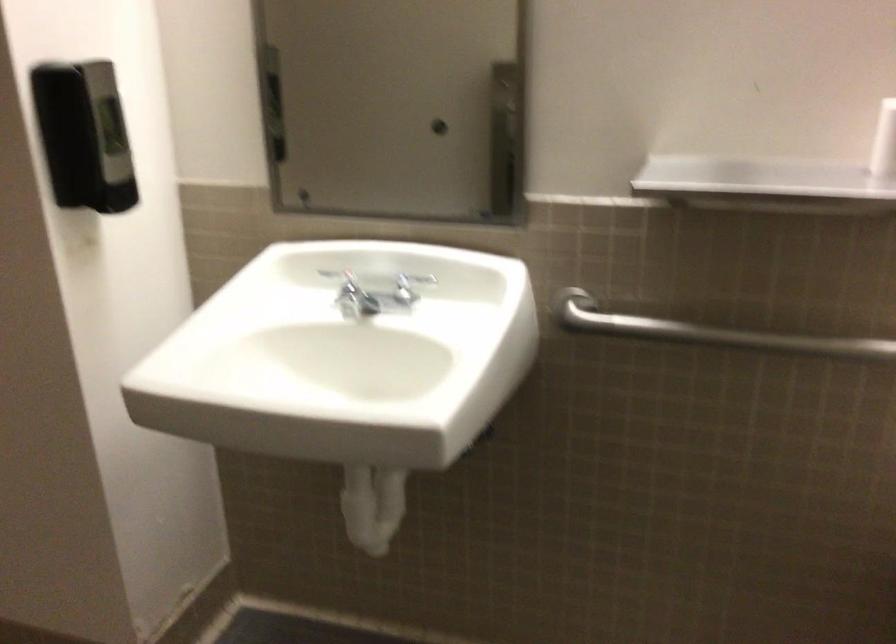
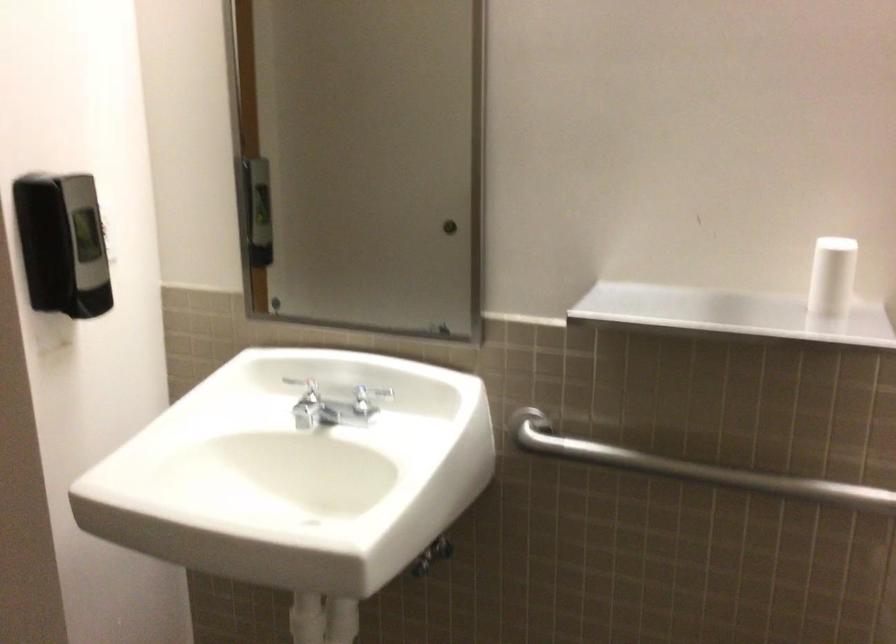
Find the pixel in the second image that matches the point at 743,337 in the first image.

(691, 468)